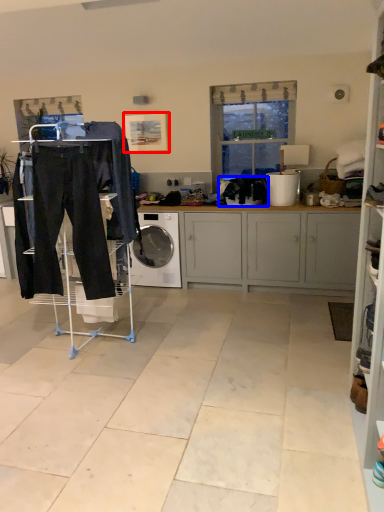
Question: Which point is closer to the camera, picture frame (highlighted by a red box) or clothing (highlighted by a blue box)?

Choices:
 (A) picture frame
 (B) clothing

Answer: (B)